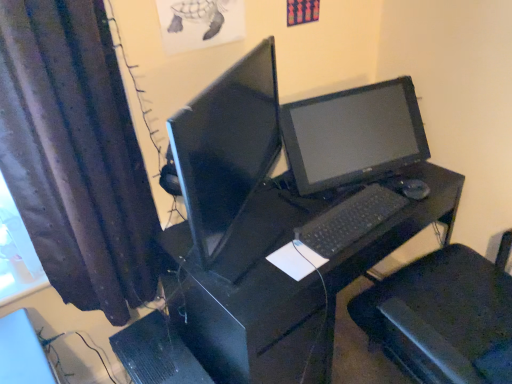
Question: From their relative heights in the image, would you say dark fabric curtain at left is taller or shorter than black plastic mouse at right?

Choices:
 (A) short
 (B) tall

Answer: (B)

Question: Considering the positions of point (144, 213) and point (399, 180), is point (144, 213) closer or farther from the camera than point (399, 180)?

Choices:
 (A) farther
 (B) closer

Answer: (B)

Question: Which is farther from the black matte keyboard at center?

Choices:
 (A) dark fabric curtain at left
 (B) white paper at center
 (C) matte black monitor at center
 (D) black plastic computer tower at lower center
 (E) black plastic mouse at right

Answer: (A)

Question: Estimate the real-world distances between objects in this image. Which object is farther from the black plastic mouse at right?

Choices:
 (A) black plastic computer tower at lower center
 (B) matte black monitor at center
 (C) white paper at center
 (D) dark fabric curtain at left
 (E) black plastic desk at center

Answer: (D)